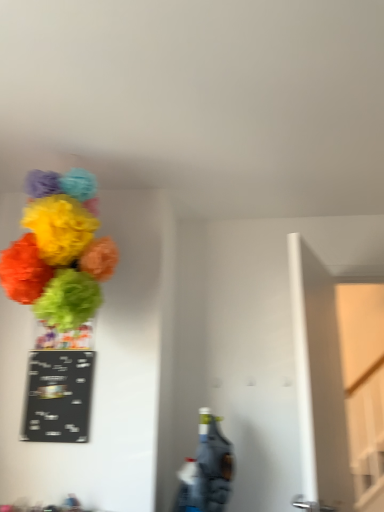
What do you see at coordinates (58, 396) in the screenshot? I see `black chalkboard at left` at bounding box center [58, 396].

I want to click on green matte vase at upper left, so pos(63,337).

From the image's perspective, is black chalkboard at left located above or below bright paper pom-poms at upper left?

black chalkboard at left is situated lower than bright paper pom-poms at upper left in the image.

Looking at their sizes, would you say black chalkboard at left is wider or thinner than bright paper pom-poms at upper left?

In the image, black chalkboard at left appears to be more narrow than bright paper pom-poms at upper left.

Considering the points (43, 436) and (80, 243), which point is behind, point (43, 436) or point (80, 243)?

The point (43, 436) is farther.

The image size is (384, 512). Find the location of `flower that appears on the right of black chalkboard at left`. flower that appears on the right of black chalkboard at left is located at coordinates (59, 250).

From a real-world perspective, between green matte vase at upper left and black chalkboard at left, who is vertically higher?

green matte vase at upper left, from a real-world perspective.

Is green matte vase at upper left outside of black chalkboard at left?

green matte vase at upper left lies outside black chalkboard at left's area.

Between green matte vase at upper left and black chalkboard at left, which one appears on the right side from the viewer's perspective?

Positioned to the right is black chalkboard at left.

Is black chalkboard at left at the back of green matte vase at upper left?

No, green matte vase at upper left's orientation is not away from black chalkboard at left.

From the picture: Is black chalkboard at left not near green matte vase at upper left?

No.

Is point (59, 409) positioned after point (37, 337)?

No.

Is black chalkboard at left further to camera compared to green matte vase at upper left?

No, black chalkboard at left is closer to the camera.

Which is behind, bright paper pom-poms at upper left or black chalkboard at left?

Answer: black chalkboard at left is more distant.

Looking at this image, between bright paper pom-poms at upper left and black chalkboard at left, which one appears on the right side from the viewer's perspective?

Positioned to the right is bright paper pom-poms at upper left.

Is bright paper pom-poms at upper left facing away from black chalkboard at left?

No.

Is green matte vase at upper left inside or outside of bright paper pom-poms at upper left?

green matte vase at upper left cannot be found inside bright paper pom-poms at upper left.

Looking at this image, from a real-world perspective, who is located lower, green matte vase at upper left or bright paper pom-poms at upper left?

In real-world perspective, green matte vase at upper left is lower.

Is green matte vase at upper left positioned with its back to bright paper pom-poms at upper left?

No, green matte vase at upper left is not facing away from bright paper pom-poms at upper left.

You are a GUI agent. You are given a task and a screenshot of the screen. Output one action in this format:
    pyautogui.click(x=<x>, y=<y>)
    Task: Click on the vase that is under the bright paper pom-poms at upper left (from a real-world perspective)
    
    Given the screenshot: What is the action you would take?
    pyautogui.click(x=63, y=337)

Find the location of a particular element. The width and height of the screenshot is (384, 512). vase directly beneath the bright paper pom-poms at upper left (from a real-world perspective) is located at coordinates (63, 337).

From the image's perspective, which one is positioned higher, bright paper pom-poms at upper left or green matte vase at upper left?

bright paper pom-poms at upper left is shown above in the image.

Between bright paper pom-poms at upper left and green matte vase at upper left, which one is positioned in front?

Positioned in front is bright paper pom-poms at upper left.

From a real-world perspective, is bright paper pom-poms at upper left physically below green matte vase at upper left?

No.

This screenshot has height=512, width=384. I want to click on flower that is above the black chalkboard at left (from the image's perspective), so click(59, 250).

You are a GUI agent. You are given a task and a screenshot of the screen. Output one action in this format:
    pyautogui.click(x=<x>, y=<y>)
    Task: Click on the writing that appears below the green matte vase at upper left (from the image's perspective)
    
    Given the screenshot: What is the action you would take?
    pyautogui.click(x=58, y=396)

From the image, which object appears to be farther from bright paper pom-poms at upper left, black chalkboard at left or green matte vase at upper left?

black chalkboard at left is further to bright paper pom-poms at upper left.

When comparing their distances from green matte vase at upper left, does black chalkboard at left or bright paper pom-poms at upper left seem further?

bright paper pom-poms at upper left is further to green matte vase at upper left.

Which object lies further to the anchor point black chalkboard at left, green matte vase at upper left or bright paper pom-poms at upper left?

Among the two, bright paper pom-poms at upper left is located further to black chalkboard at left.

Considering their positions, is bright paper pom-poms at upper left positioned closer to black chalkboard at left than green matte vase at upper left?

green matte vase at upper left is positioned closer to the anchor black chalkboard at left.

Based on the photo, from the image, which object appears to be farther from green matte vase at upper left, bright paper pom-poms at upper left or black chalkboard at left?

bright paper pom-poms at upper left is positioned further to the anchor green matte vase at upper left.

Based on their spatial positions, is green matte vase at upper left or black chalkboard at left further from bright paper pom-poms at upper left?

black chalkboard at left is positioned further to the anchor bright paper pom-poms at upper left.

Identify the location of vase that lies between bright paper pom-poms at upper left and black chalkboard at left from top to bottom. The image size is (384, 512). (63, 337).